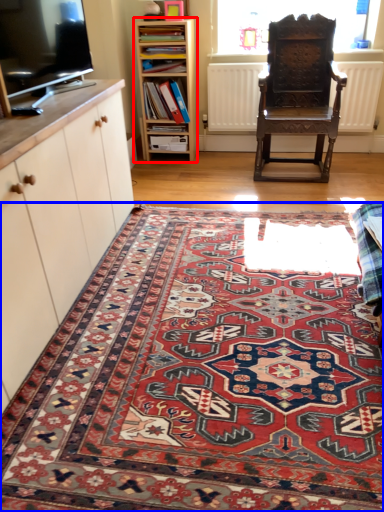
Question: Among these objects, which one is farthest to the camera, shelf (highlighted by a red box) or mat (highlighted by a blue box)?

Choices:
 (A) shelf
 (B) mat

Answer: (A)